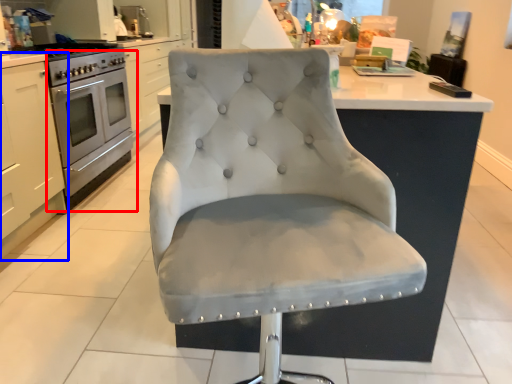
Question: Among these objects, which one is farthest to the camera, oven (highlighted by a red box) or cabinetry (highlighted by a blue box)?

Choices:
 (A) oven
 (B) cabinetry

Answer: (A)